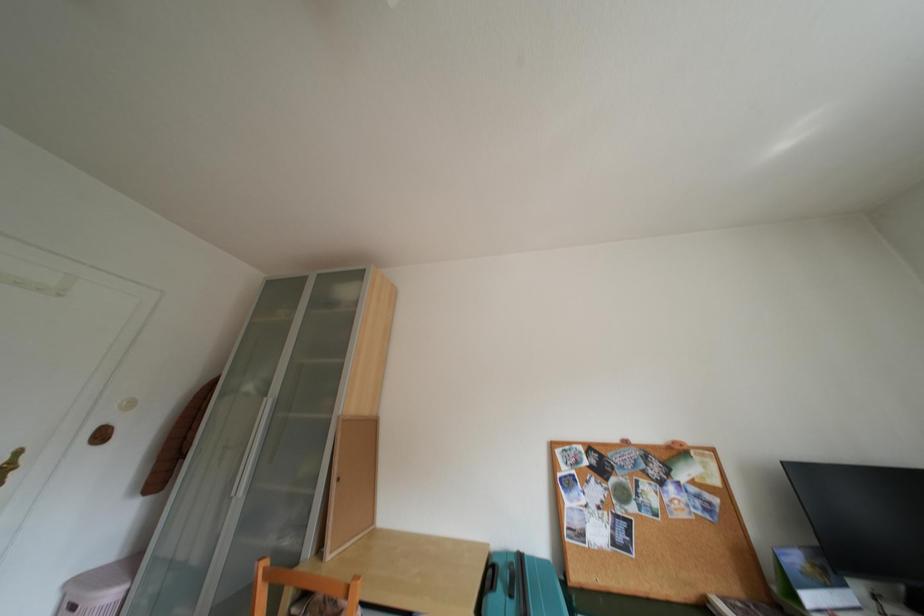
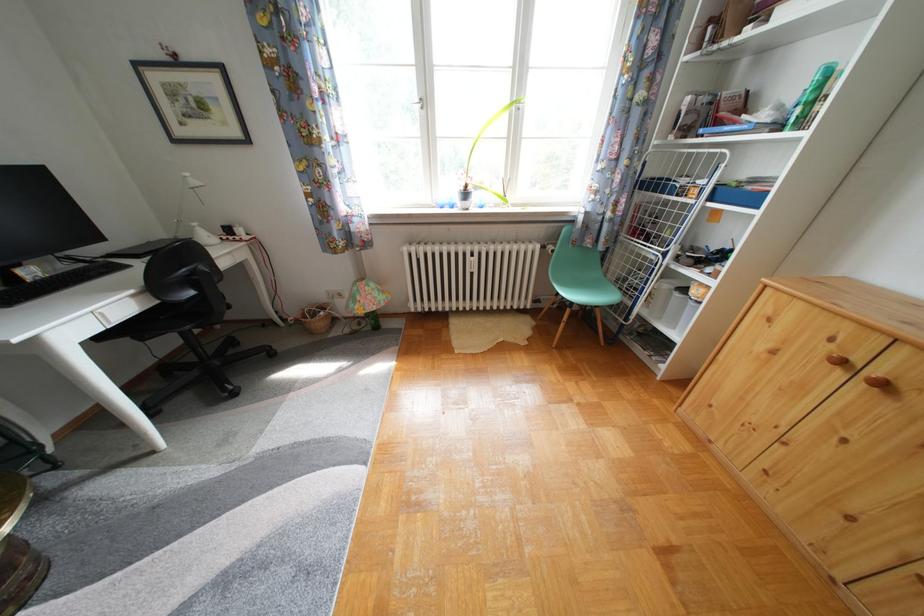
First-person continuous shooting, in which direction is the camera rotating?

The camera rotated toward right-down.